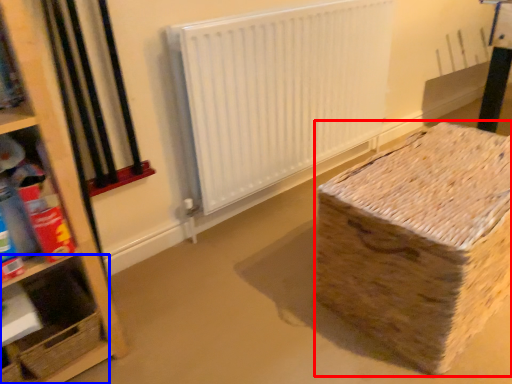
Question: Which of the following is the closest to the observer, cardboard box (highlighted by a red box) or shelf (highlighted by a blue box)?

Choices:
 (A) cardboard box
 (B) shelf

Answer: (A)